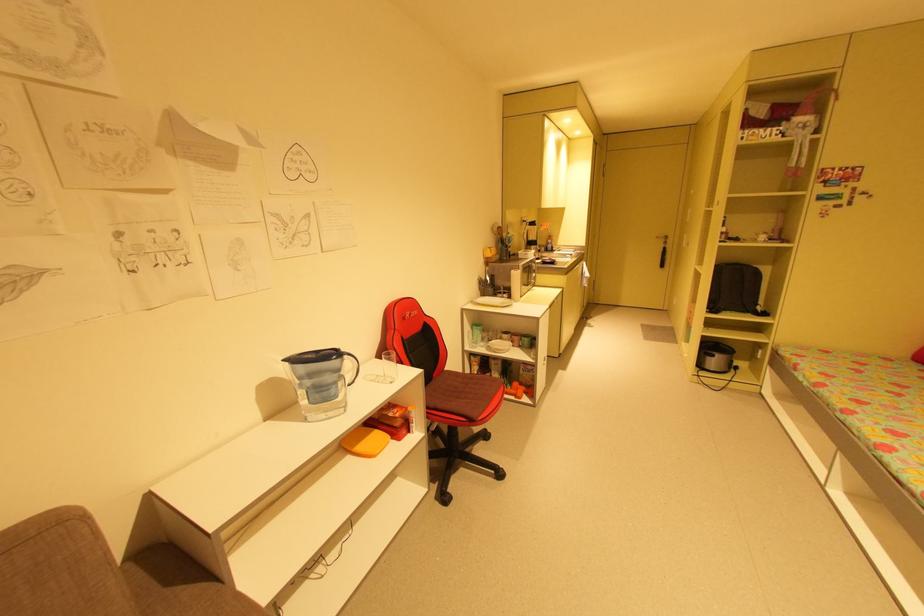
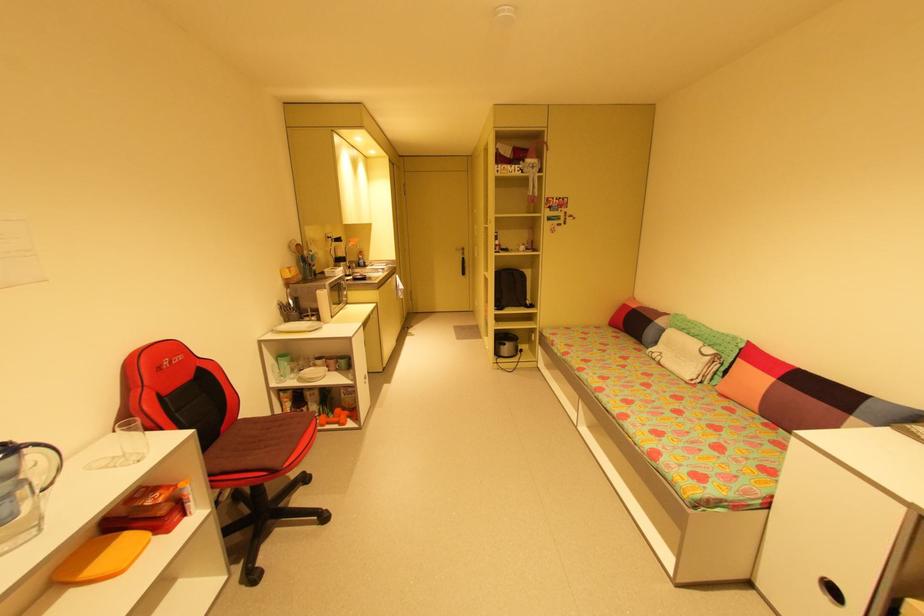
Where in the second image is the point corresponding to (482,333) from the first image?

(290, 363)